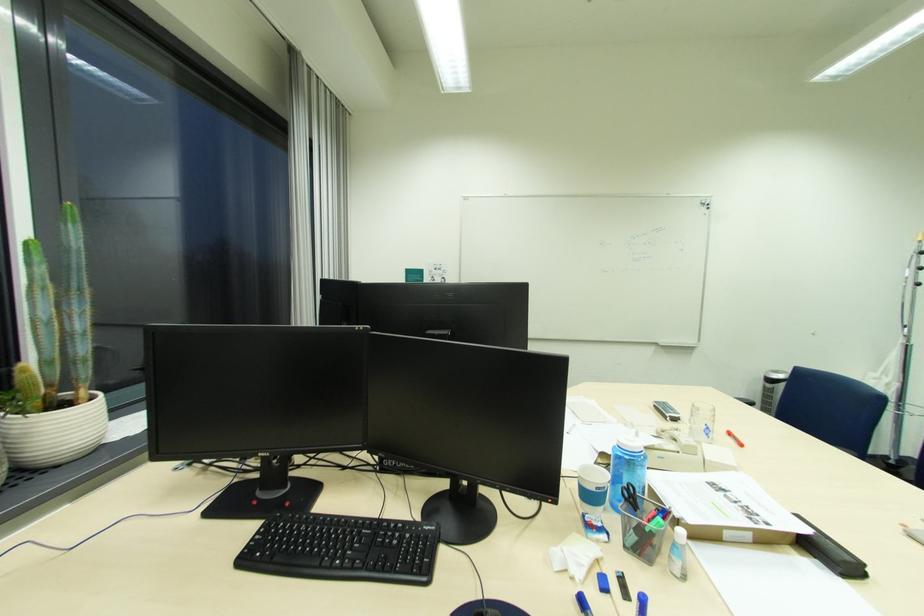
The image size is (924, 616). Find the location of `white plant pot`. white plant pot is located at coordinates (55, 361).